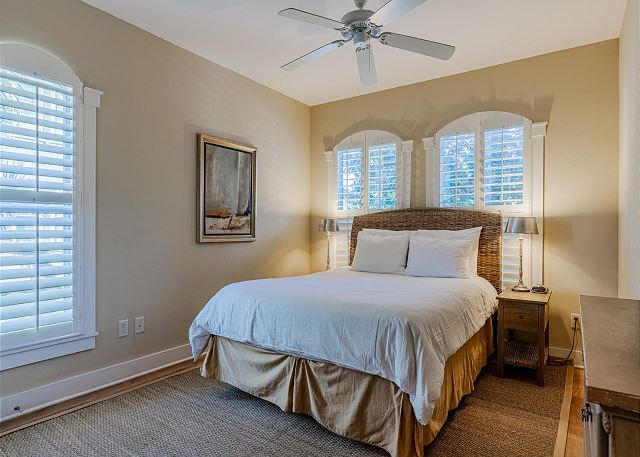
The image size is (640, 457). I want to click on pillows on bed, so click(383, 254), click(378, 231), click(431, 231), click(461, 251).